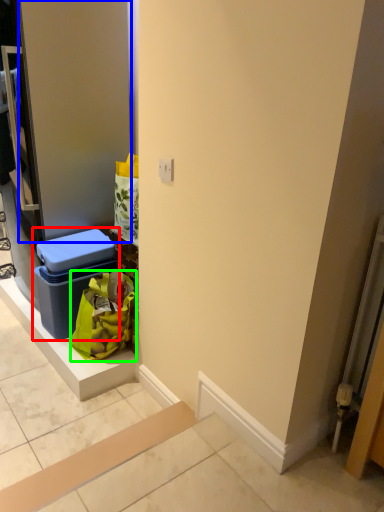
Question: Estimate the real-world distances between objects in this image. Which object is closer to storage box (highlighted by a red box), door (highlighted by a blue box) or shopping bag (highlighted by a green box)?

Choices:
 (A) door
 (B) shopping bag

Answer: (B)